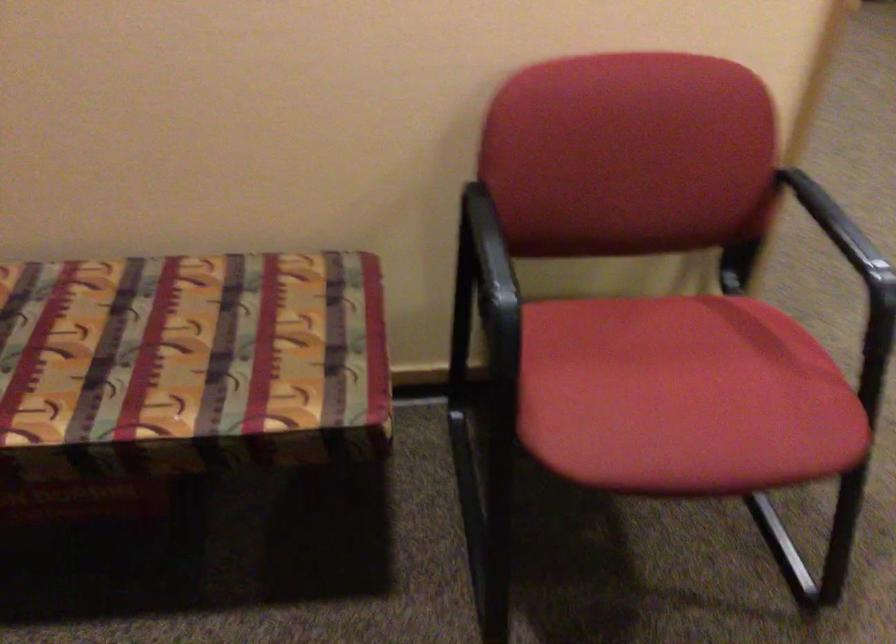
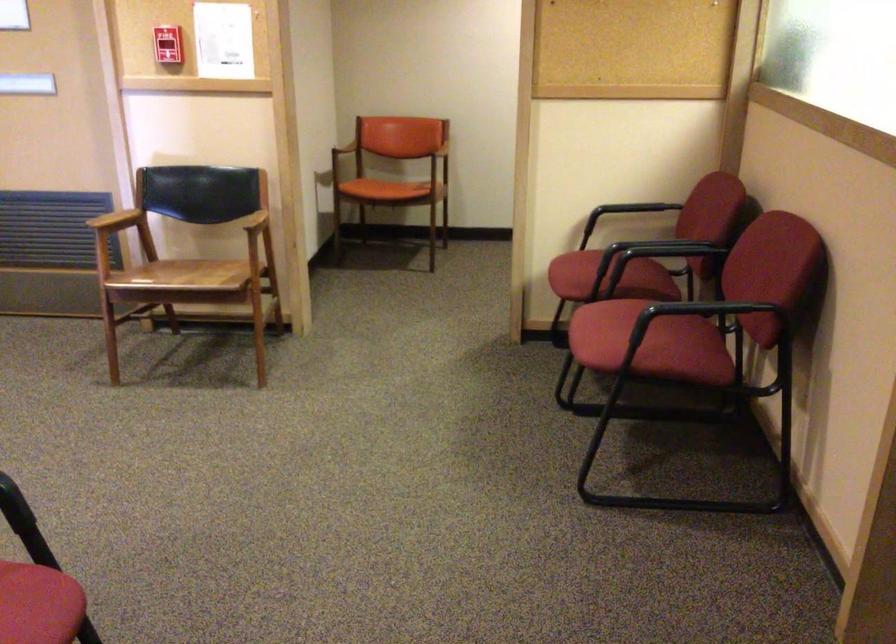
In the second image, find the point that corresponds to the point at 765,453 in the first image.

(39, 605)